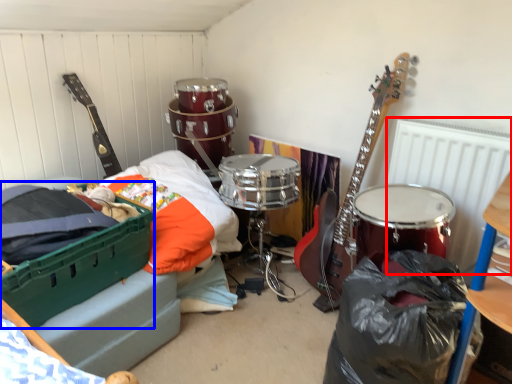
Question: Among these objects, which one is nearest to the camera, radiator (highlighted by a red box) or storage box (highlighted by a blue box)?

Choices:
 (A) radiator
 (B) storage box

Answer: (B)